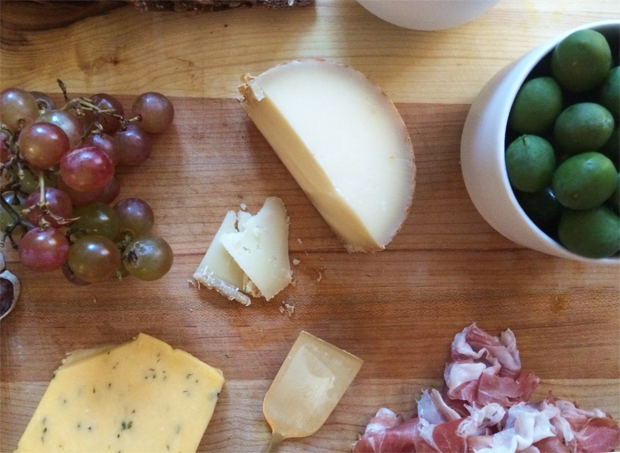
Identify the location of brown wood board. (418, 322), (503, 191).